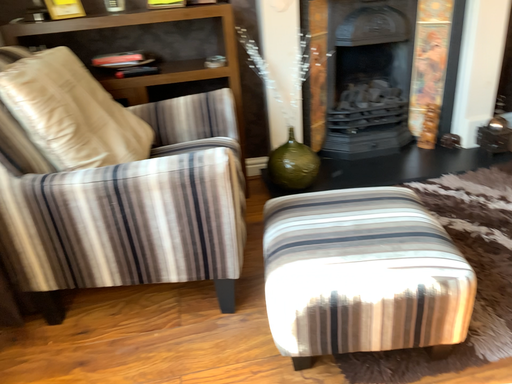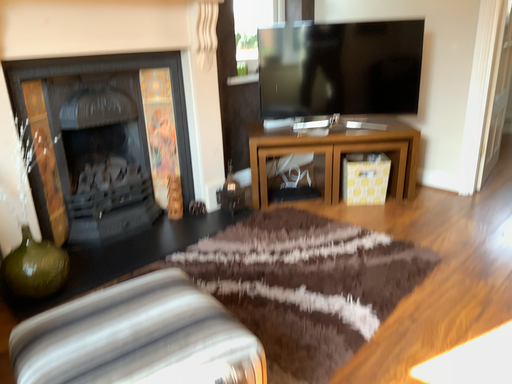
Question: How did the camera likely rotate when shooting the video?

Choices:
 (A) rotated upward
 (B) rotated downward

Answer: (A)